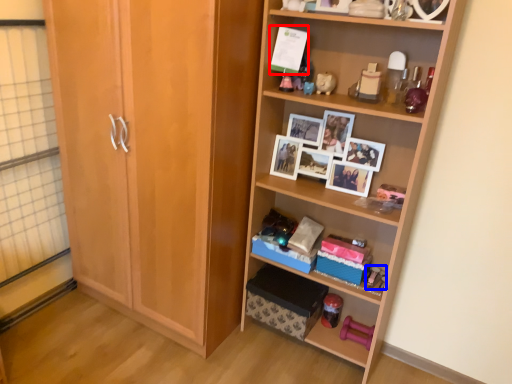
Question: Among these objects, which one is farthest to the camera, postcard (highlighted by a red box) or toy (highlighted by a blue box)?

Choices:
 (A) postcard
 (B) toy

Answer: (B)